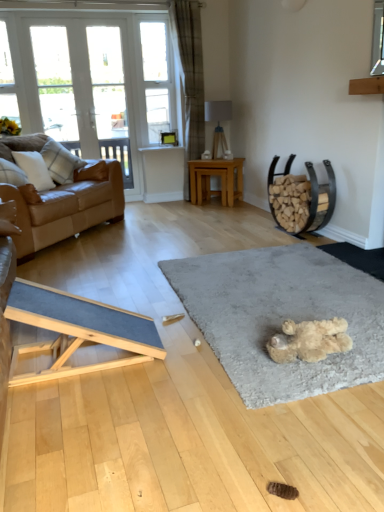
Locate an element on the screen. vacant location behind wooden ramp at lower left, the 1th table positioned from the front is located at coordinates (144, 301).